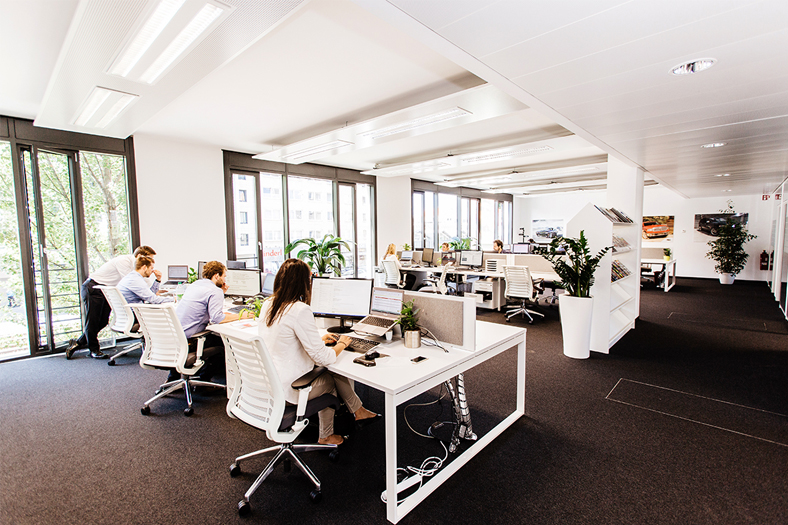
The image size is (788, 525). Identify the location of chairs. (250, 392), (160, 335), (116, 313), (523, 282), (388, 270).